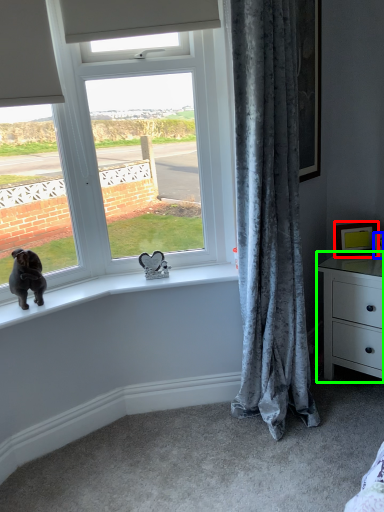
Question: Based on their relative distances, which object is nearer to picture frame (highlighted by a red box)? Choose from picture frame (highlighted by a blue box) and chest of drawers (highlighted by a green box).

Choices:
 (A) picture frame
 (B) chest of drawers

Answer: (A)